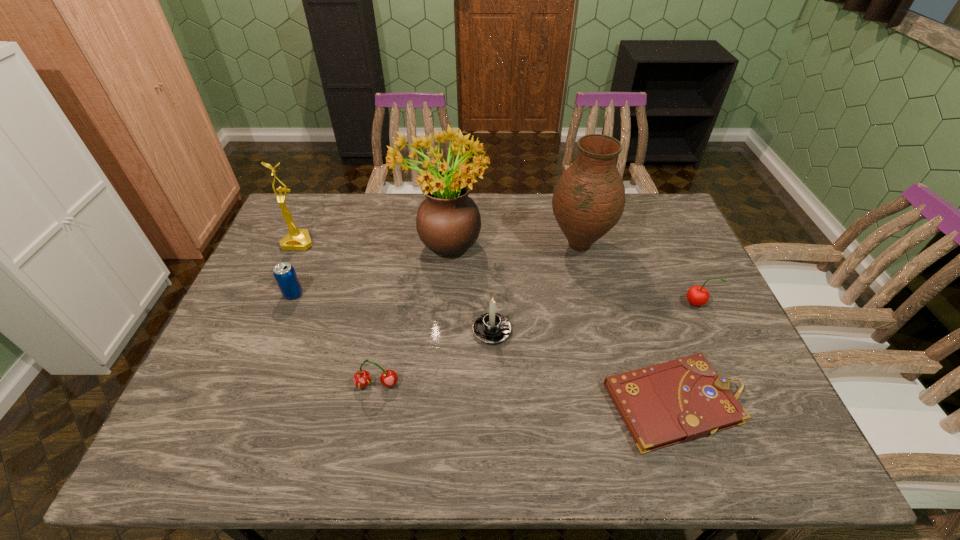
Identify the location of flower arrangement. This screenshot has width=960, height=540. (448, 222).

In order to click on vase in this screenshot , I will do `click(588, 200)`.

Locate an element on the screen. Image resolution: width=960 pixels, height=540 pixels. the third tallest object is located at coordinates (297, 239).

At what (x,y) coordinates should I click in order to perform the action: click on the third nearest object. Please return your answer as a coordinate pair (x, y). Looking at the image, I should click on (492, 328).

The height and width of the screenshot is (540, 960). In order to click on the right cherry in this screenshot , I will do `click(697, 295)`.

Locate an element on the screen. The image size is (960, 540). pop soda is located at coordinates (284, 273).

At what (x,y) coordinates should I click in order to perform the action: click on the shorter cherry. Please return your answer as a coordinate pair (x, y). The height and width of the screenshot is (540, 960). Looking at the image, I should click on (362, 378).

You are a GUI agent. You are given a task and a screenshot of the screen. Output one action in this format:
    pyautogui.click(x=<x>, y=<y>)
    Task: Click on the nearer cherry
    
    Given the screenshot: What is the action you would take?
    pyautogui.click(x=362, y=378)

Image resolution: width=960 pixels, height=540 pixels. What are the coordinates of `the shortest object` in the screenshot? It's located at (681, 400).

I want to click on vacant space located 0.140m on the left of the flower arrangement, so click(x=355, y=244).